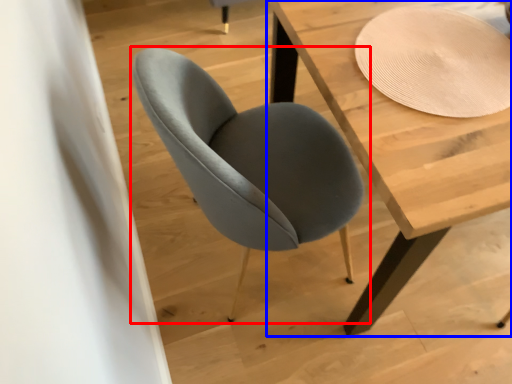
Question: Which object appears farthest to the camera in this image, chair (highlighted by a red box) or table (highlighted by a blue box)?

Choices:
 (A) chair
 (B) table

Answer: (B)